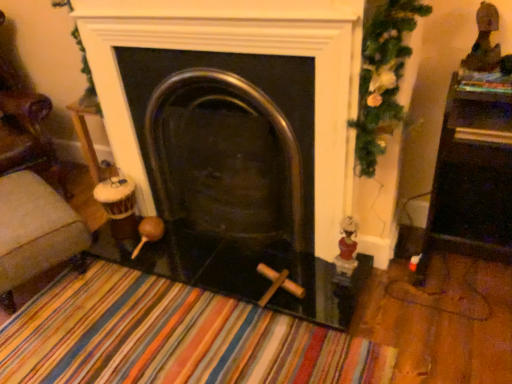
The width and height of the screenshot is (512, 384). Identify the location of free space to the left of white porcelain figurine at right, which appears as the second toy when viewed from the top. (315, 283).